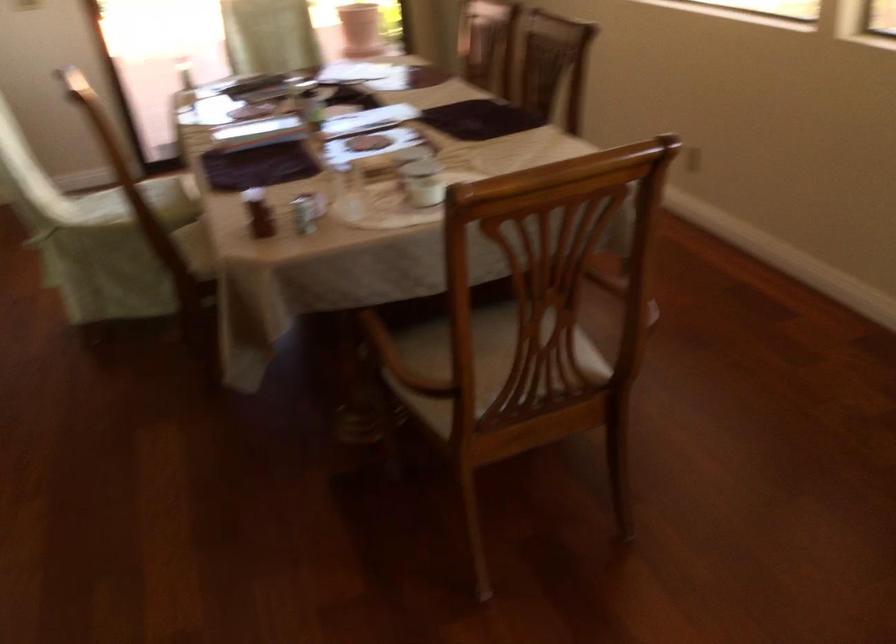
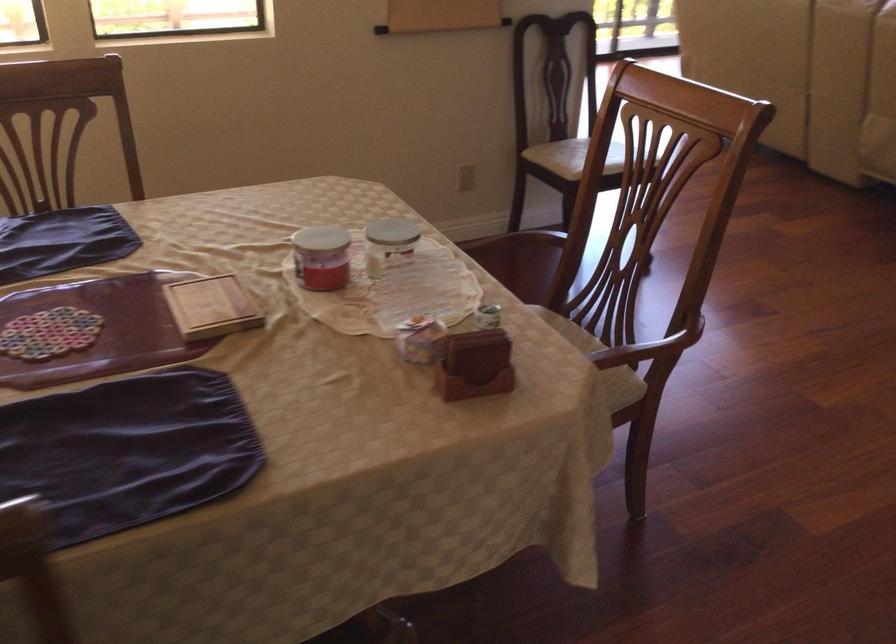
Locate, in the second image, the point that corresponds to pixel 375 353 in the first image.

(642, 351)